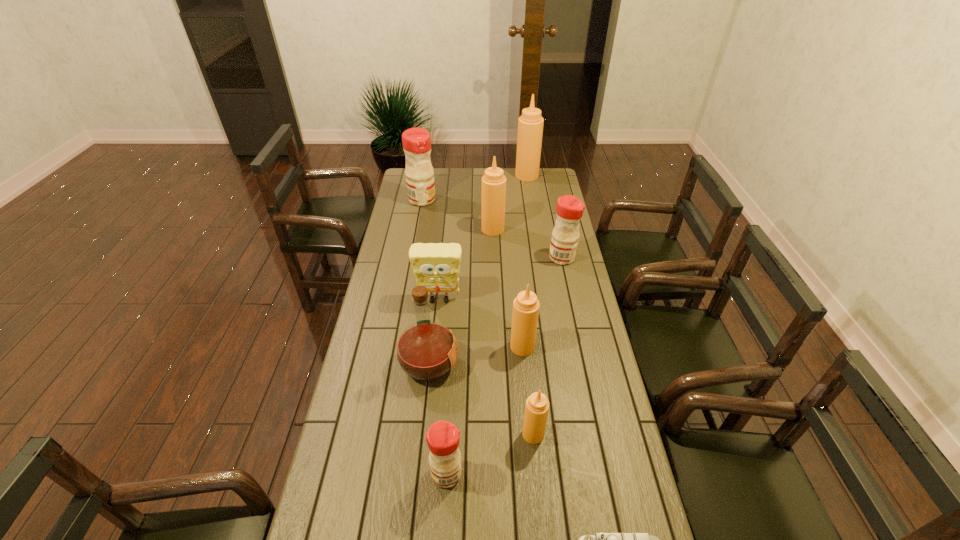
You are a GUI agent. You are given a task and a screenshot of the screen. Output one action in this format:
    pyautogui.click(x=<x>, y=<y>)
    Task: Click on the fourth closest tan condiment to the rightmost red condiment
    
    Given the screenshot: What is the action you would take?
    [537, 405]

Identify which red condiment is the closest to the pink liquor. Please provide its 2D coordinates. Your answer should be formatted as a tuple, i.e. [(x, y)], where the tuple contains the x and y coordinates of a point satisfying the conditions above.

[(443, 437)]

Locate an element on the screen. red condiment that can be found as the closest to the fourth nearest condiment is located at coordinates (416, 141).

I want to click on free region that satisfies the following two spatial constraints: 1. on the front side of the second nearest red condiment; 2. on the front label of the liquor, so click(586, 364).

In order to click on vacant position in the image that satisfies the following two spatial constraints: 1. on the front label of the third nearest object; 2. on the right side of the liquor in this screenshot , I will do `click(421, 434)`.

Where is `free space in the image that satisfies the following two spatial constraints: 1. on the front label of the smallest tan condiment; 2. on the right side of the pink liquor`? free space in the image that satisfies the following two spatial constraints: 1. on the front label of the smallest tan condiment; 2. on the right side of the pink liquor is located at coordinates click(x=421, y=434).